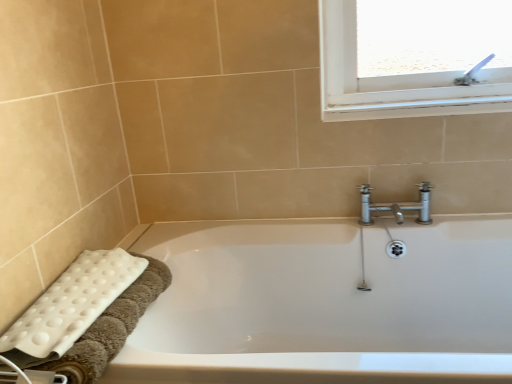
In order to click on blank space situated above white textured bath towel at lower left (from a real-world perspective) in this screenshot , I will do `click(74, 289)`.